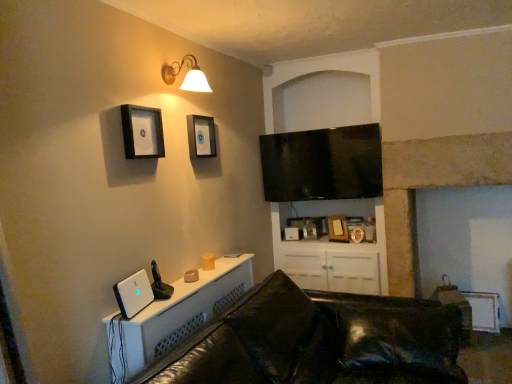
Question: Is wooden picture frame at center, which ranks as the third picture frame in left-to-right order, oriented away from matte black picture frame at upper center, placed as the 1th picture frame when sorted from top to bottom?

Choices:
 (A) no
 (B) yes

Answer: (A)

Question: From a real-world perspective, does wooden picture frame at center, the 3th picture frame positioned from the top, stand above matte black picture frame at upper center, the second picture frame viewed from the left?

Choices:
 (A) no
 (B) yes

Answer: (A)

Question: Would you say wooden picture frame at center, the 3th picture frame positioned from the top, contains matte black picture frame at upper center, placed as the 1th picture frame when sorted from top to bottom?

Choices:
 (A) no
 (B) yes

Answer: (A)

Question: Does wooden picture frame at center, the 2th picture frame positioned from the right, lie in front of matte black picture frame at upper center, the second picture frame viewed from the left?

Choices:
 (A) yes
 (B) no

Answer: (B)

Question: Is wooden picture frame at center, the 1th picture frame in the back-to-front sequence, in contact with matte black picture frame at upper center, the third picture frame viewed from the back?

Choices:
 (A) yes
 (B) no

Answer: (B)

Question: Visually, is gold metallic picture frame at upper center, the second picture frame from the back, positioned to the left or to the right of black matte picture frame at upper left, which appears as the first picture frame when viewed from the left?

Choices:
 (A) left
 (B) right

Answer: (B)

Question: From the image's perspective, is gold metallic picture frame at upper center, arranged as the 3th picture frame when viewed from the front, above or below black matte picture frame at upper left, placed as the 4th picture frame when sorted from right to left?

Choices:
 (A) below
 (B) above

Answer: (A)

Question: Is gold metallic picture frame at upper center, the fourth picture frame when ordered from top to bottom, bigger or smaller than black matte picture frame at upper left, placed as the second picture frame when sorted from top to bottom?

Choices:
 (A) big
 (B) small

Answer: (B)

Question: In the image, is gold metallic picture frame at upper center, arranged as the 3th picture frame when viewed from the front, positioned in front of or behind black matte picture frame at upper left, which appears as the first picture frame when viewed from the left?

Choices:
 (A) front
 (B) behind

Answer: (B)

Question: From the image's perspective, is matte black picture frame at upper center, the third picture frame viewed from the back, positioned above or below white plastic desktop computer at lower left?

Choices:
 (A) above
 (B) below

Answer: (A)

Question: From a real-world perspective, is matte black picture frame at upper center, the third picture frame viewed from the back, above or below white plastic desktop computer at lower left?

Choices:
 (A) below
 (B) above

Answer: (B)

Question: Considering the positions of matte black picture frame at upper center, which is the fourth picture frame from bottom to top, and white plastic desktop computer at lower left in the image, is matte black picture frame at upper center, which is the fourth picture frame from bottom to top, wider or thinner than white plastic desktop computer at lower left?

Choices:
 (A) wide
 (B) thin

Answer: (B)

Question: Is matte black picture frame at upper center, which is the fourth picture frame from bottom to top, to the left or to the right of white plastic desktop computer at lower left in the image?

Choices:
 (A) left
 (B) right

Answer: (B)

Question: Looking at the image, does black matte picture frame at upper left, which appears as the first picture frame when viewed from the left, seem bigger or smaller compared to black leather couch at lower center?

Choices:
 (A) big
 (B) small

Answer: (B)

Question: Is black matte picture frame at upper left, the third picture frame from the bottom, in front of or behind black leather couch at lower center in the image?

Choices:
 (A) behind
 (B) front

Answer: (A)